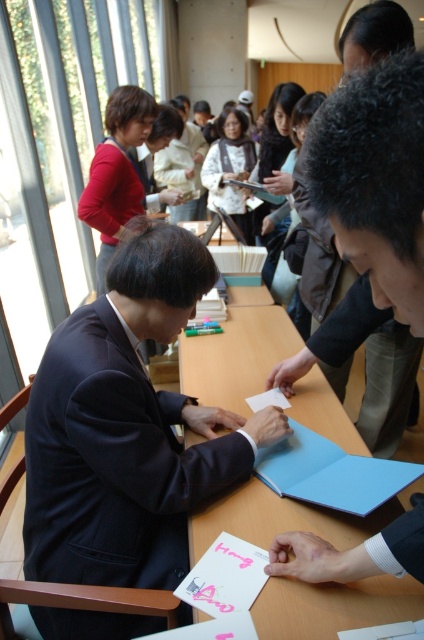
You are a photographer standing in the library scene. You want to take a photo of the dark blue fabric business suit at center and the wooden table at center. Which object should you focus on first if you want to capture both in a single frame without moving the camera?

The dark blue fabric business suit at center is located below the wooden table at center, so you should focus on the wooden table at center first to ensure both objects are in the frame.

Consider the image. Based on the scene description, where is the wooden table at center located relative to the pink matte card at lower center?

The wooden table at center is located to the right of the pink matte card at lower center.